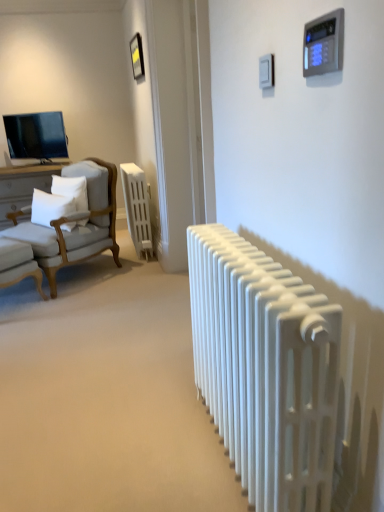
Question: Does white soft pillow at left, the first pillow viewed from the right, lie behind white soft pillow at left, which ranks as the 2th pillow in right-to-left order?

Choices:
 (A) no
 (B) yes

Answer: (B)

Question: Are white soft pillow at left, the first pillow viewed from the right, and white soft pillow at left, the 1th pillow viewed from the left, located far from each other?

Choices:
 (A) no
 (B) yes

Answer: (A)

Question: Can you confirm if white soft pillow at left, the 2th pillow in the left-to-right sequence, is wider than white soft pillow at left, which ranks as the 2th pillow in right-to-left order?

Choices:
 (A) no
 (B) yes

Answer: (B)

Question: Is white soft pillow at left, the 2th pillow in the left-to-right sequence, shorter than white soft pillow at left, which ranks as the 2th pillow in right-to-left order?

Choices:
 (A) yes
 (B) no

Answer: (B)

Question: Considering the relative sizes of white soft pillow at left, the first pillow viewed from the right, and white soft pillow at left, the 1th pillow viewed from the left, in the image provided, is white soft pillow at left, the first pillow viewed from the right, bigger than white soft pillow at left, the 1th pillow viewed from the left,?

Choices:
 (A) yes
 (B) no

Answer: (A)

Question: From the image's perspective, is white soft pillow at left, the first pillow viewed from the right, above white soft pillow at left, the 1th pillow viewed from the left?

Choices:
 (A) yes
 (B) no

Answer: (A)

Question: From the image's perspective, does light gray fabric chair at left, positioned as the second chair in bottom-to-top order, appear lower than white matte radiator at center, the 2th radiator when ordered from top to bottom?

Choices:
 (A) no
 (B) yes

Answer: (A)

Question: Does light gray fabric chair at left, marked as the first chair in a top-to-bottom arrangement, turn towards white matte radiator at center, the second radiator from the left?

Choices:
 (A) no
 (B) yes

Answer: (A)

Question: Considering the relative positions of light gray fabric chair at left, marked as the first chair in a top-to-bottom arrangement, and white matte radiator at center, acting as the 1th radiator starting from the bottom, in the image provided, is light gray fabric chair at left, marked as the first chair in a top-to-bottom arrangement, in front of white matte radiator at center, acting as the 1th radiator starting from the bottom,?

Choices:
 (A) yes
 (B) no

Answer: (B)

Question: From the image's perspective, is light gray fabric chair at left, marked as the first chair in a top-to-bottom arrangement, above white matte radiator at center, the 2th radiator when ordered from top to bottom?

Choices:
 (A) no
 (B) yes

Answer: (B)

Question: Is light gray fabric chair at left, positioned as the second chair in bottom-to-top order, behind white matte radiator at center, acting as the first radiator starting from the right?

Choices:
 (A) no
 (B) yes

Answer: (B)

Question: From a real-world perspective, is light gray fabric chair at left, marked as the first chair in a top-to-bottom arrangement, beneath white matte radiator at center, acting as the first radiator starting from the right?

Choices:
 (A) yes
 (B) no

Answer: (B)

Question: Is metallic gold picture frame at upper center at the left side of white matte radiator at center, which is counted as the second radiator, starting from the right?

Choices:
 (A) no
 (B) yes

Answer: (A)